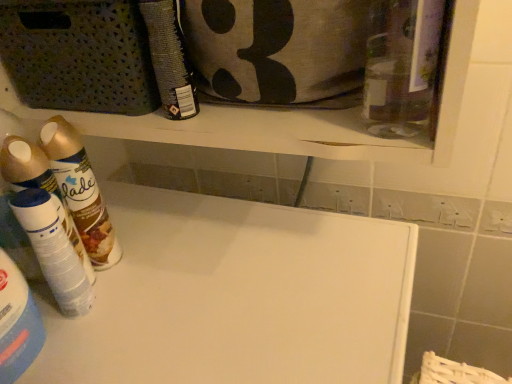
Question: From the image's perspective, is white plastic spray can at left, positioned as the second cleaning product in right-to-left order, above or below white matte board at center?

Choices:
 (A) below
 (B) above

Answer: (B)

Question: In terms of height, does white plastic spray can at left, positioned as the second cleaning product in left-to-right order, look taller or shorter compared to white matte board at center?

Choices:
 (A) short
 (B) tall

Answer: (A)

Question: Based on their relative distances, which object is farther from the white matte board at center?

Choices:
 (A) matte black spray can at upper center, acting as the 3th cleaning product starting from the left
 (B) gold metallic spray can at left, the first cleaning product in the left-to-right sequence
 (C) textured gray fabric pouch at upper center
 (D) white plastic spray can at left, positioned as the second cleaning product in left-to-right order

Answer: (C)

Question: Considering the real-world distances, which object is farthest from the matte black spray can at upper center, acting as the 3th cleaning product starting from the left?

Choices:
 (A) white matte board at center
 (B) white plastic spray can at left, positioned as the second cleaning product in left-to-right order
 (C) textured gray fabric pouch at upper center
 (D) gold metallic spray can at left, the first cleaning product in the left-to-right sequence

Answer: (A)